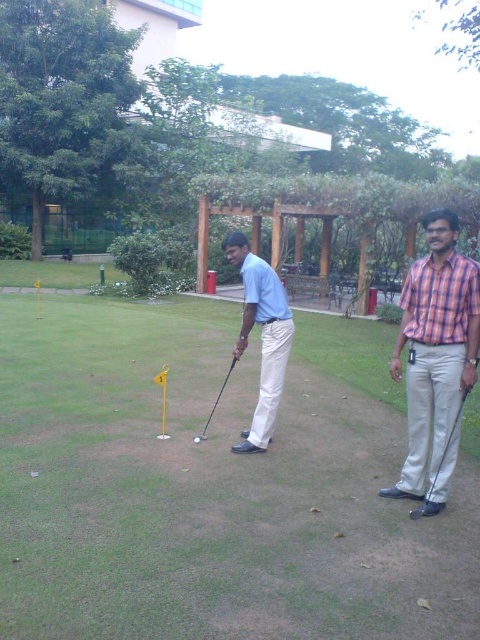
Between point (408, 384) and point (201, 440), which one is positioned in front?

Point (408, 384) is more forward.

Which is below, checkered fabric shirt at right or shiny silver golf ball at center?

shiny silver golf ball at center is below.

The height and width of the screenshot is (640, 480). I want to click on checkered fabric shirt at right, so click(435, 358).

How much distance is there between metallic silver golf club at lower right and shiny silver golf ball at center?

The distance of metallic silver golf club at lower right from shiny silver golf ball at center is 2.05 meters.

Measure the distance between metallic silver golf club at lower right and camera.

3.90 meters

Locate an element on the screen. metallic silver golf club at lower right is located at coordinates (440, 460).

From the picture: Can you confirm if matte white golf ball at center is taller than checkered fabric shirt at right?

Incorrect, matte white golf ball at center's height is not larger of checkered fabric shirt at right's.

Can you confirm if matte white golf ball at center is bigger than checkered fabric shirt at right?

Indeed, matte white golf ball at center has a larger size compared to checkered fabric shirt at right.

Is point (227, 588) positioned before point (447, 384)?

Yes, it is.

Find the location of `matte white golf ball at center`. matte white golf ball at center is located at coordinates (212, 480).